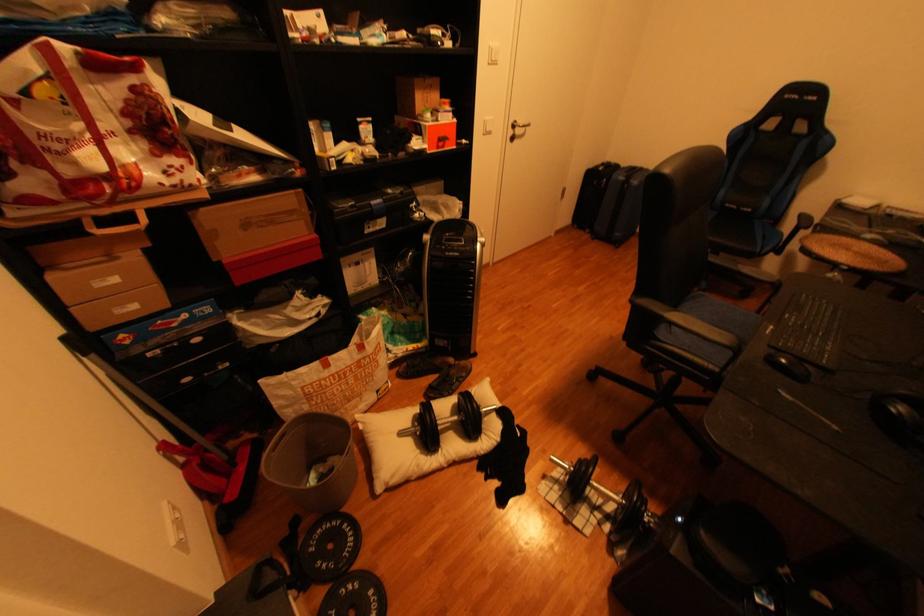
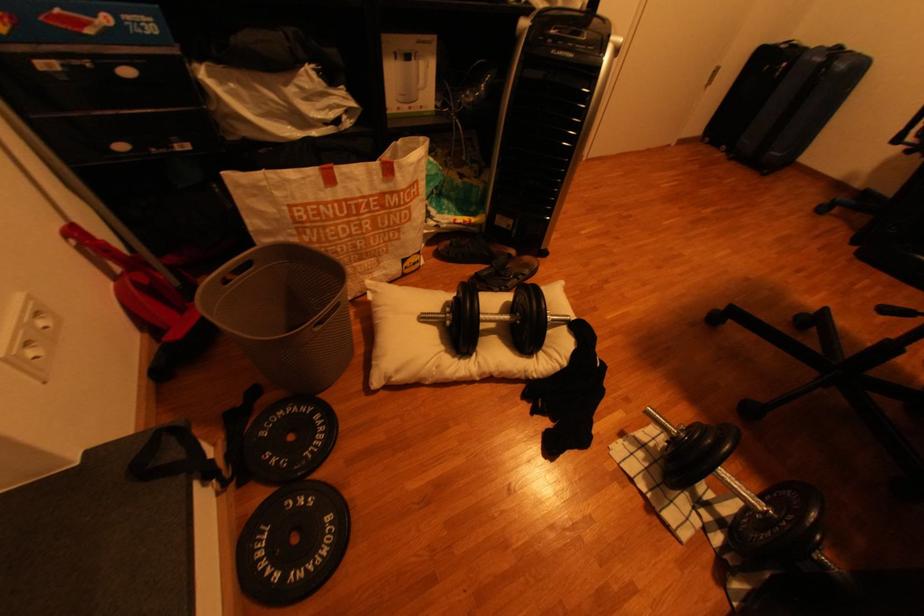
Question: The images are taken continuously from a first-person perspective. In which direction are you moving?

Choices:
 (A) Left
 (B) Right
 (C) Forward
 (D) Backward

Answer: (C)